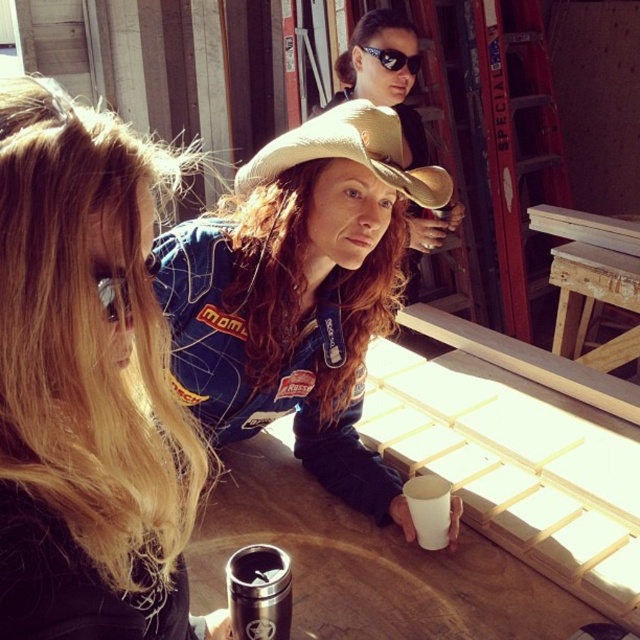
Can you confirm if white paper cup at lower center is smaller than sunglasses at upper center?

Correct, white paper cup at lower center occupies less space than sunglasses at upper center.

Is point (424, 528) closer to camera compared to point (387, 61)?

Yes, point (424, 528) is closer to viewer.

Who is more distant from viewer, [420,518] or [364,49]?

Positioned behind is point [364,49].

You are a GUI agent. You are given a task and a screenshot of the screen. Output one action in this format:
    pyautogui.click(x=<x>, y=<y>)
    Task: Click on the white paper cup at lower center
    The width and height of the screenshot is (640, 640).
    Given the screenshot: What is the action you would take?
    pyautogui.click(x=429, y=509)

Can you confirm if matte blue jacket at center is positioned below sunglasses at upper center?

Correct, matte blue jacket at center is located below sunglasses at upper center.

Who is more forward, (x=333, y=493) or (x=362, y=45)?

Point (x=333, y=493)

The width and height of the screenshot is (640, 640). I want to click on matte blue jacket at center, so click(x=298, y=292).

Identify the location of matte blue jacket at center. (298, 292).

Does point (257, 192) come farther from viewer compared to point (112, 275)?

Yes, point (257, 192) is behind point (112, 275).

Measure the distance between matte blue jacket at center and matte black goggles at upper center.

They are 24.16 inches apart.

This screenshot has width=640, height=640. Identify the location of matte blue jacket at center. (298, 292).